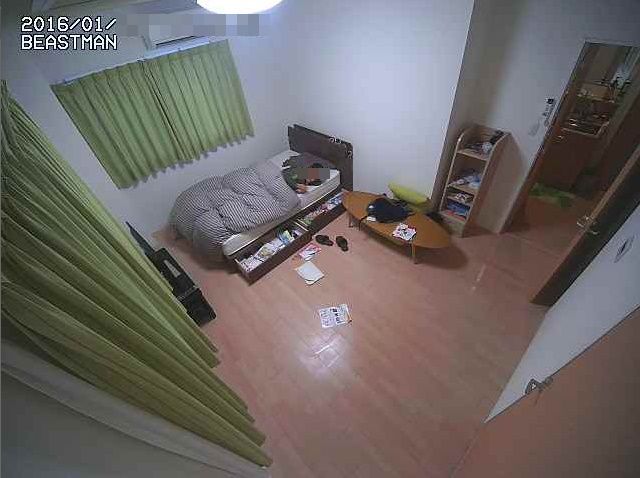
The height and width of the screenshot is (478, 640). Find the location of `metal door handle`. metal door handle is located at coordinates (593, 232).